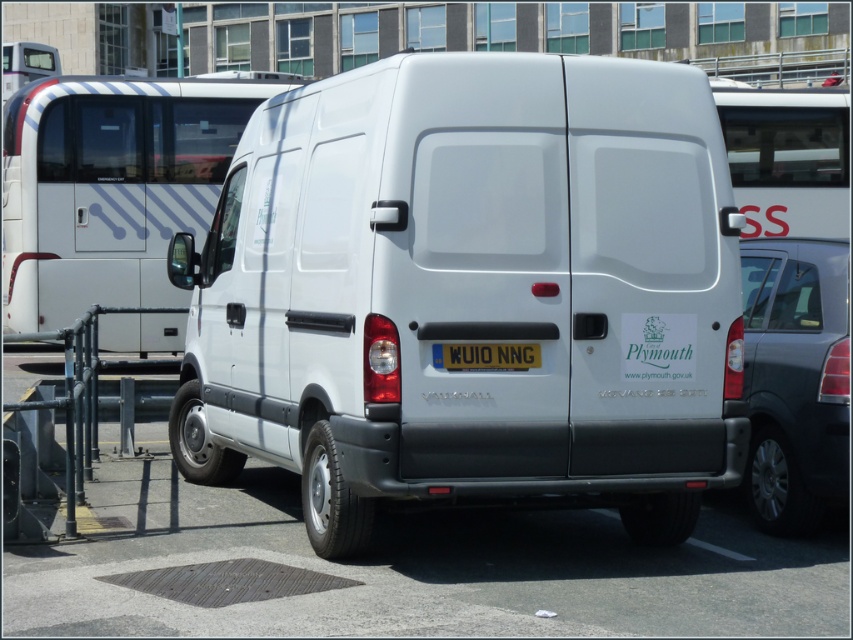
Question: Which point appears farthest from the camera in this image?

Choices:
 (A) (210, 176)
 (B) (811, 244)
 (C) (488, 346)
 (D) (357, 150)

Answer: (A)

Question: Does white matte van at center have a greater width compared to satin black car at right?

Choices:
 (A) no
 (B) yes

Answer: (B)

Question: Which object is farther from the camera taking this photo?

Choices:
 (A) white glossy minibus at center
 (B) satin black car at right
 (C) white plastic license plate at center

Answer: (A)

Question: Can you confirm if white matte van at center is positioned below white plastic license plate at center?

Choices:
 (A) no
 (B) yes

Answer: (A)

Question: Is white glossy minibus at center bigger than white plastic license plate at center?

Choices:
 (A) no
 (B) yes

Answer: (A)

Question: Which object is the closest to the white glossy minibus at center?

Choices:
 (A) white plastic license plate at center
 (B) white matte van at center
 (C) satin black car at right

Answer: (B)